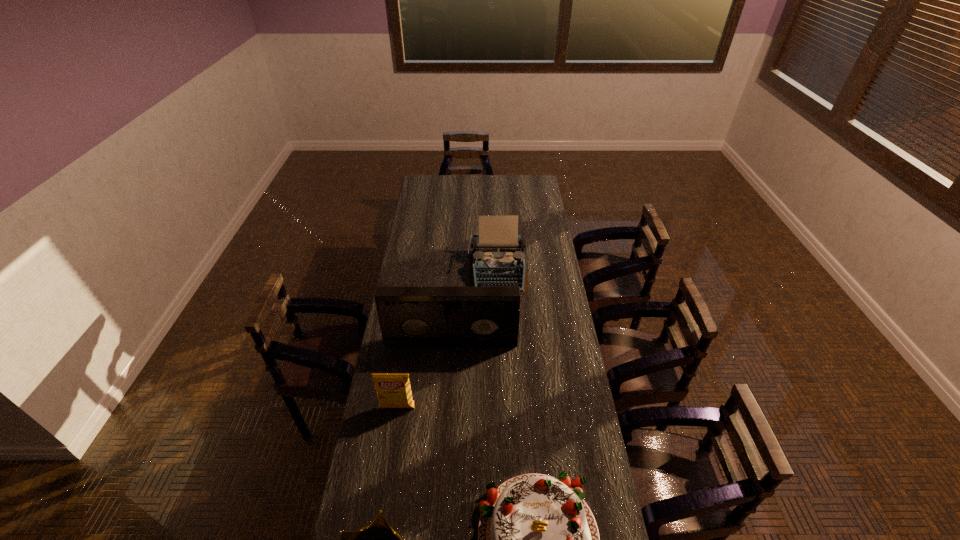
In order to click on the tallest object in this screenshot , I will do `click(410, 317)`.

Find the location of a particular element. videotape is located at coordinates (410, 317).

Locate an element on the screen. This screenshot has width=960, height=540. the farthest object is located at coordinates (x=498, y=260).

Where is `the third nearest object`? The width and height of the screenshot is (960, 540). the third nearest object is located at coordinates (393, 390).

Find the location of a particular element. vacant region located 0.120m on the front side of the fourth nearest object is located at coordinates (449, 373).

In order to click on free space located on the typing side of the typewriter in this screenshot , I will do `click(500, 328)`.

At what (x,y) coordinates should I click in order to perform the action: click on vacant space positioned 0.220m on the front of the crisp (potato chip) with the logo. Please return your answer as a coordinate pair (x, y). This screenshot has width=960, height=540. Looking at the image, I should click on (387, 475).

The image size is (960, 540). Identify the location of videotape that is at the left edge. coord(410,317).

Find the location of `crisp (potato chip) located at the left edge`. crisp (potato chip) located at the left edge is located at coordinates (393, 390).

Image resolution: width=960 pixels, height=540 pixels. In order to click on object located at the right edge in this screenshot , I will do `click(498, 260)`.